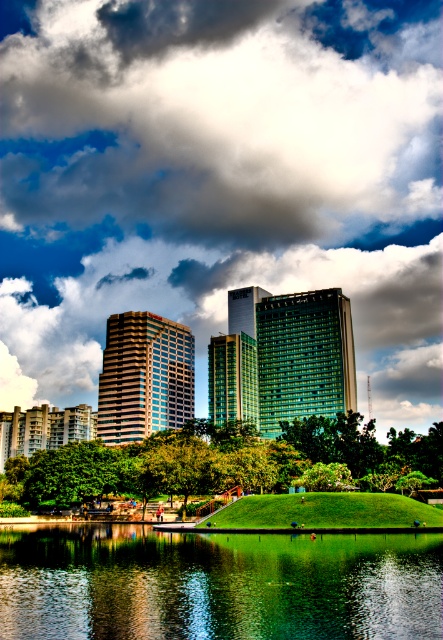
Question: Can you confirm if cloudy sky at upper center is wider than green leafy tree at center?

Choices:
 (A) no
 (B) yes

Answer: (B)

Question: Which object is the closest to the cloudy sky at upper center?

Choices:
 (A) green leafy tree at center
 (B) green reflective water at center

Answer: (A)

Question: Considering the real-world distances, which object is closest to the green leafy tree at center?

Choices:
 (A) cloudy sky at upper center
 (B) green reflective water at center

Answer: (B)

Question: Estimate the real-world distances between objects in this image. Which object is farther from the green leafy tree at center?

Choices:
 (A) cloudy sky at upper center
 (B) green reflective water at center

Answer: (A)

Question: Is cloudy sky at upper center smaller than green reflective water at center?

Choices:
 (A) no
 (B) yes

Answer: (A)

Question: Is green reflective water at center wider than green leafy tree at center?

Choices:
 (A) yes
 (B) no

Answer: (B)